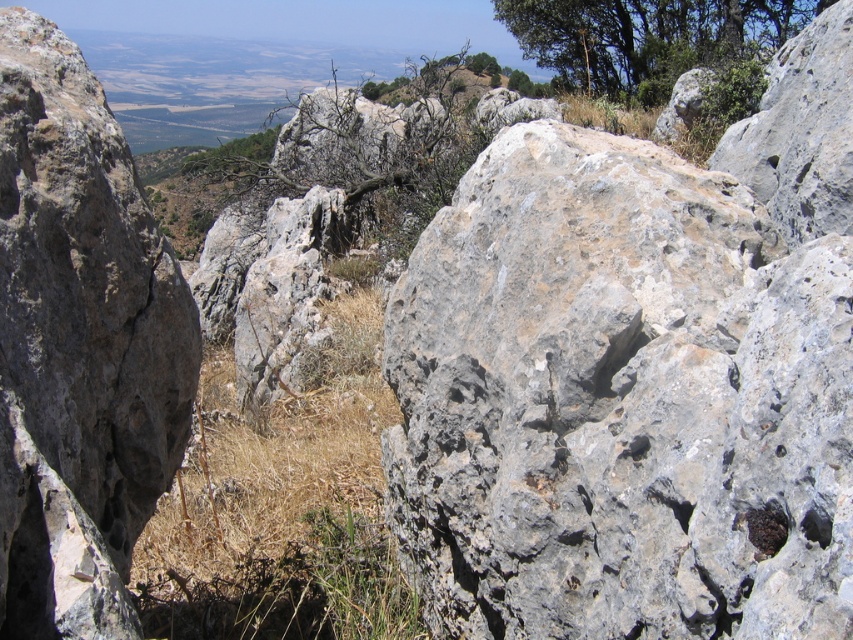
Looking at this image, is dry grass at center in front of green leafy tree at upper right?

Yes, it is.

How far apart are dry grass at center and green leafy tree at upper right?

42.51 feet

Which is behind, point (361, 435) or point (614, 83)?

Point (614, 83)

Where is `dry grass at center`? The width and height of the screenshot is (853, 640). dry grass at center is located at coordinates (282, 508).